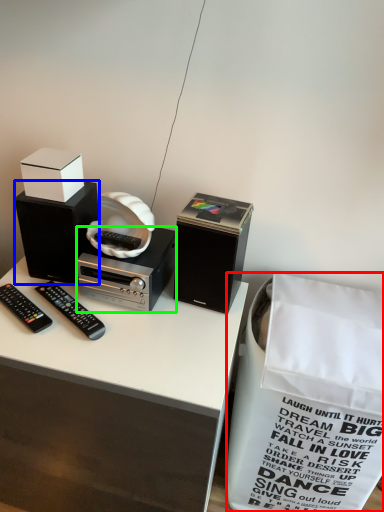
Question: Which object is positioned farthest from shopping bag (highlighted by a red box)? Select from speaker (highlighted by a blue box) and cassette (highlighted by a green box).

Choices:
 (A) speaker
 (B) cassette

Answer: (A)